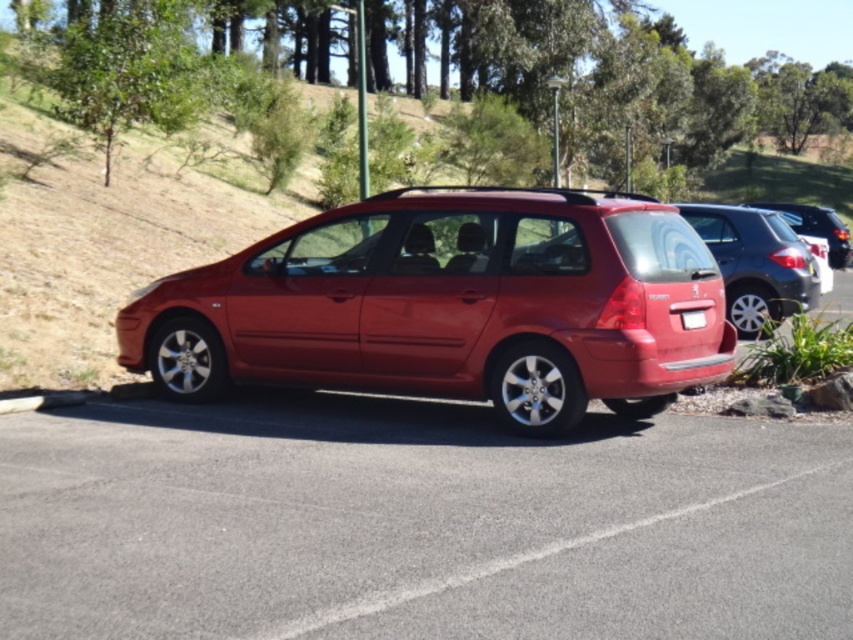
Measure the distance from glossy asphalt parking lot at center to glossy metallic car at center.

5.55 feet

Is point (396, 624) positioned before point (312, 273)?

Yes, it is.

Between point (750, 452) and point (567, 212), which one is positioned in front?

Point (750, 452) is in front.

I want to click on glossy asphalt parking lot at center, so click(416, 524).

Who is more distant from viewer, (508, 458) or (695, 312)?

Positioned behind is point (695, 312).

This screenshot has height=640, width=853. I want to click on glossy asphalt parking lot at center, so click(416, 524).

Where is `glossy asphalt parking lot at center`? The height and width of the screenshot is (640, 853). glossy asphalt parking lot at center is located at coordinates (416, 524).

Is glossy asphalt parking lot at center to the right of glossy metallic minivan at right from the viewer's perspective?

Incorrect, glossy asphalt parking lot at center is not on the right side of glossy metallic minivan at right.

Is glossy asphalt parking lot at center above glossy metallic minivan at right?

No, glossy asphalt parking lot at center is not above glossy metallic minivan at right.

Identify the location of glossy asphalt parking lot at center. The image size is (853, 640). (416, 524).